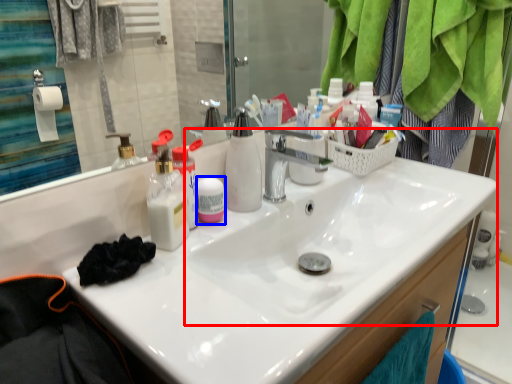
Question: Which point is further to the camera, sink (highlighted by a red box) or toiletries (highlighted by a blue box)?

Choices:
 (A) sink
 (B) toiletries

Answer: (B)